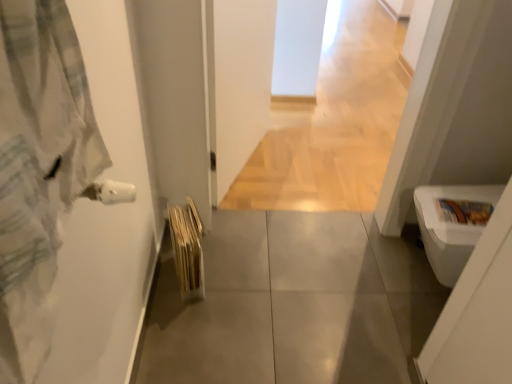
Question: Is light gray flannel bathrobe at left in front of beige textured bath towel at lower left?

Choices:
 (A) no
 (B) yes

Answer: (B)

Question: Is light gray flannel bathrobe at left located outside beige textured bath towel at lower left?

Choices:
 (A) yes
 (B) no

Answer: (A)

Question: Could you tell me if light gray flannel bathrobe at left is turned towards beige textured bath towel at lower left?

Choices:
 (A) no
 (B) yes

Answer: (A)

Question: Considering the relative sizes of light gray flannel bathrobe at left and beige textured bath towel at lower left in the image provided, is light gray flannel bathrobe at left smaller than beige textured bath towel at lower left?

Choices:
 (A) yes
 (B) no

Answer: (A)

Question: Can you confirm if light gray flannel bathrobe at left is taller than beige textured bath towel at lower left?

Choices:
 (A) no
 (B) yes

Answer: (B)

Question: From a real-world perspective, does light gray flannel bathrobe at left sit lower than beige textured bath towel at lower left?

Choices:
 (A) yes
 (B) no

Answer: (B)

Question: Does light gray flannel bathrobe at left have a greater height compared to white glossy toilet bowl at lower right?

Choices:
 (A) no
 (B) yes

Answer: (A)

Question: Is light gray flannel bathrobe at left to the right of white glossy toilet bowl at lower right from the viewer's perspective?

Choices:
 (A) yes
 (B) no

Answer: (B)

Question: Could you tell me if light gray flannel bathrobe at left is turned towards white glossy toilet bowl at lower right?

Choices:
 (A) no
 (B) yes

Answer: (A)

Question: Can you confirm if light gray flannel bathrobe at left is bigger than white glossy toilet bowl at lower right?

Choices:
 (A) yes
 (B) no

Answer: (B)

Question: From a real-world perspective, is light gray flannel bathrobe at left below white glossy toilet bowl at lower right?

Choices:
 (A) yes
 (B) no

Answer: (B)

Question: Considering the relative sizes of light gray flannel bathrobe at left and white glossy toilet bowl at lower right in the image provided, is light gray flannel bathrobe at left smaller than white glossy toilet bowl at lower right?

Choices:
 (A) yes
 (B) no

Answer: (A)

Question: Is light gray flannel bathrobe at left placed right next to gray tile floor at center?

Choices:
 (A) no
 (B) yes

Answer: (A)